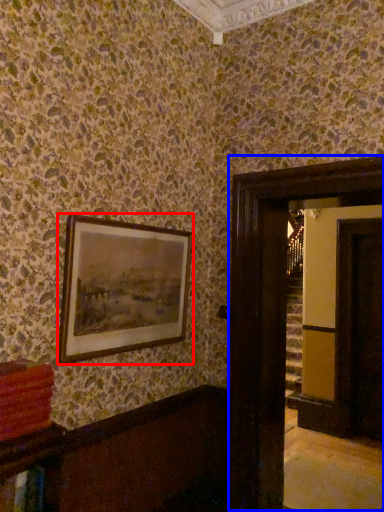
Question: Which point is further to the camera, picture frame (highlighted by a red box) or glass door (highlighted by a blue box)?

Choices:
 (A) picture frame
 (B) glass door

Answer: (B)